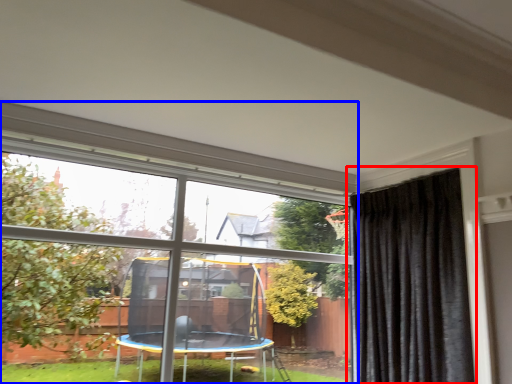
Question: Among these objects, which one is nearest to the camera, curtain (highlighted by a red box) or window (highlighted by a blue box)?

Choices:
 (A) curtain
 (B) window

Answer: (B)